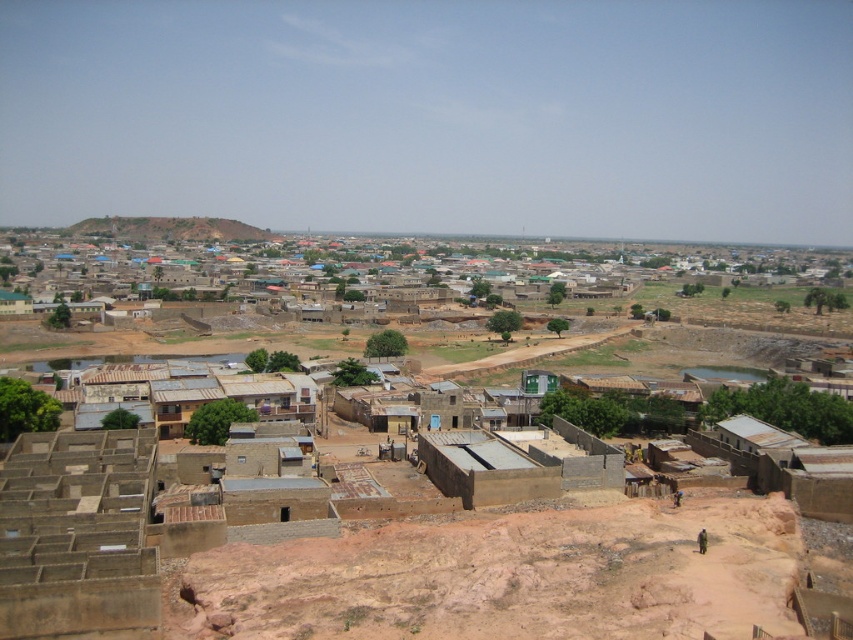
Question: Considering the relative positions of brown concrete hut at center and brown earthy hillside at upper left in the image provided, where is brown concrete hut at center located with respect to brown earthy hillside at upper left?

Choices:
 (A) right
 (B) left

Answer: (A)

Question: Can you confirm if brown concrete hut at center is positioned to the left of brown earthy hillside at upper left?

Choices:
 (A) yes
 (B) no

Answer: (B)

Question: Which point is closer to the camera?

Choices:
 (A) brown earthy hillside at upper left
 (B) brown sandy dirt field at lower center
 (C) brown concrete hut at center

Answer: (B)

Question: Which of the following is the closest to the observer?

Choices:
 (A) (558, 474)
 (B) (349, 557)
 (C) (155, 230)

Answer: (B)

Question: Can you confirm if brown concrete hut at center is bigger than brown earthy hillside at upper left?

Choices:
 (A) yes
 (B) no

Answer: (B)

Question: Which object is closer to the camera taking this photo?

Choices:
 (A) brown sandy dirt field at lower center
 (B) brown earthy hillside at upper left
 (C) brown concrete hut at center

Answer: (A)